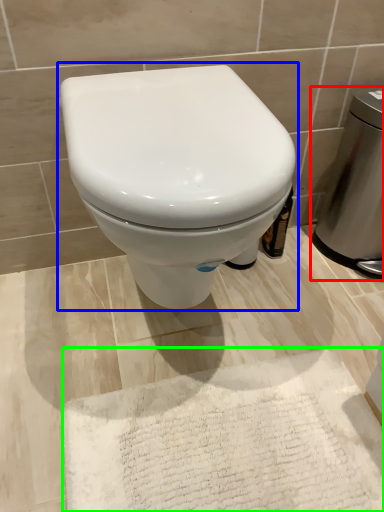
Question: Which object is positioned closest to appliance (highlighted by a red box)? Select from toilet (highlighted by a blue box) and bath mat (highlighted by a green box).

Choices:
 (A) toilet
 (B) bath mat

Answer: (A)